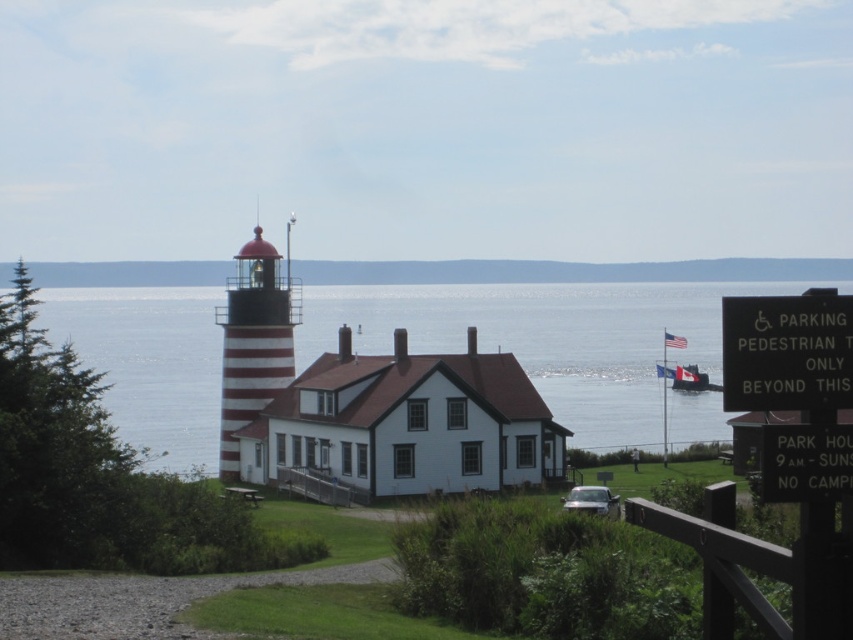
You are standing on the grassy area near the water and want to take a photo of the blue water at center and the metallic gray boat at center. Which object should you focus on first to ensure it appears sharp in the foreground?

The blue water at center is in front of the metallic gray boat at center, so you should focus on the blue water at center first to ensure it appears sharp in the foreground.

You are standing at the lighthouse and want to walk towards the point that is closer to you. Which point should you head towards, point (x=107, y=316) or point (x=815, y=298)?

You should head towards point (x=107, y=316) because it is closer to you than point (x=815, y=298).

You are a visitor at the coastal area and want to take a photo of the blue water at center and the black plastic sign at right. Which object will occupy more space in your photo?

The blue water at center occupies more space in the photo because it has a larger size compared to the black plastic sign at right.